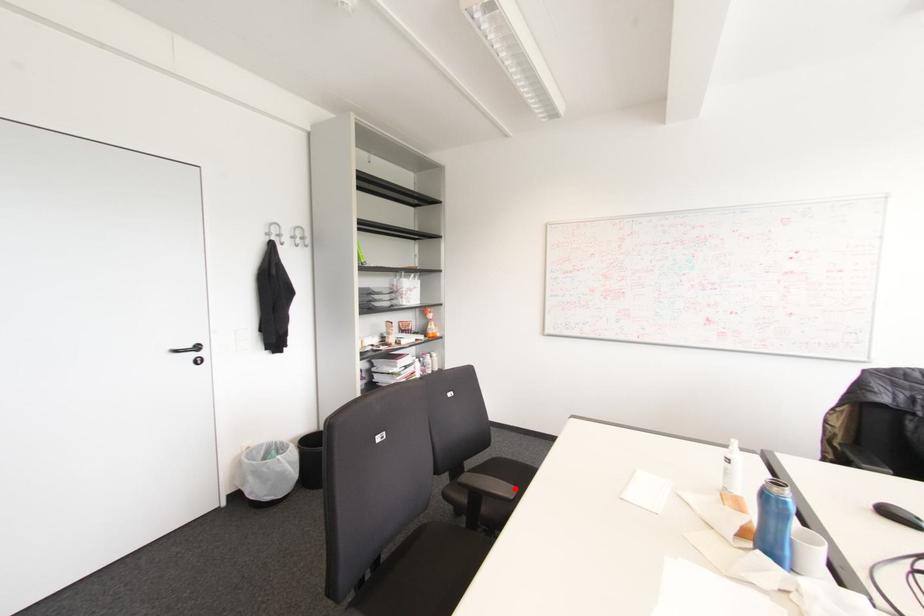
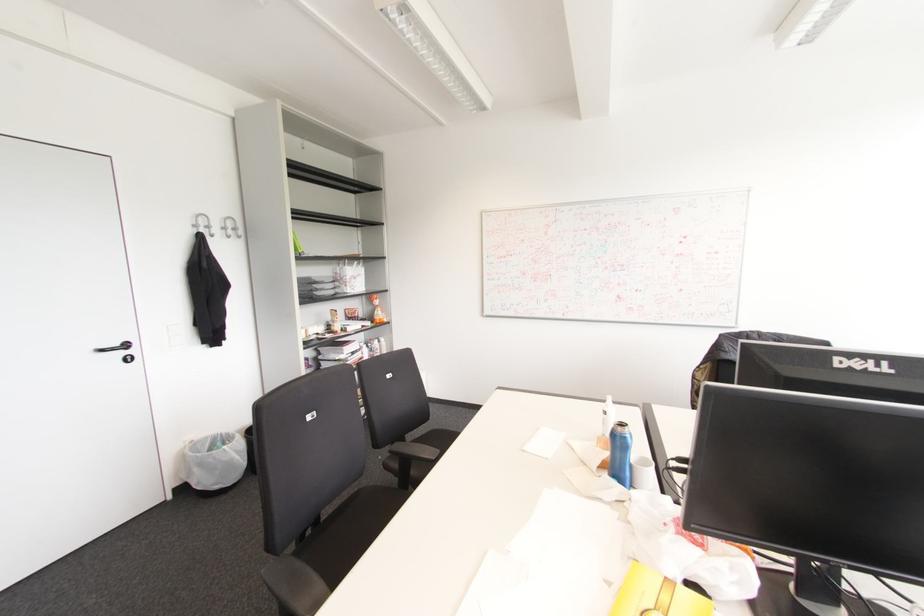
The point at the highlighted location is marked in the first image. Where is the corresponding point in the second image?

(438, 451)